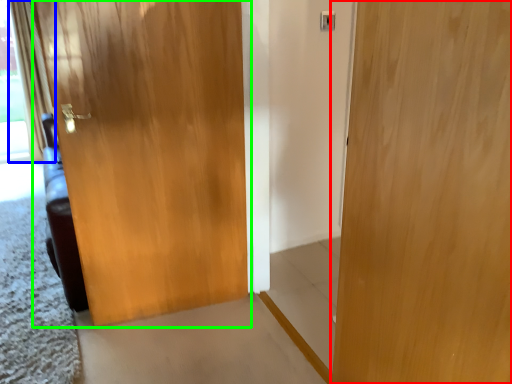
Question: Which object is the farthest from door (highlighted by a red box)? Choose among these: curtain (highlighted by a blue box) or door (highlighted by a green box).

Choices:
 (A) curtain
 (B) door

Answer: (A)